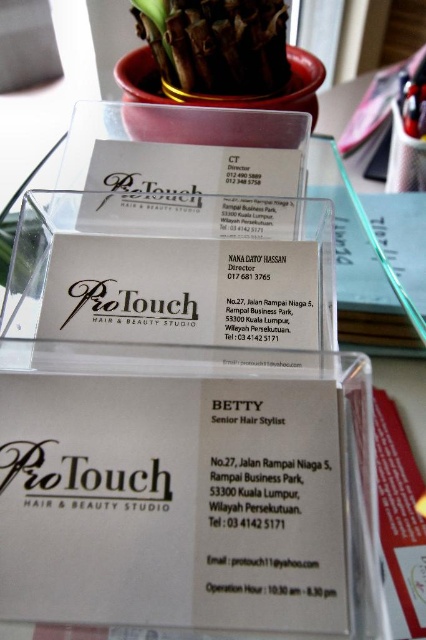
You are holding a camera and want to take a closeup photo of the white paper business card at center. The camera requires the subject to be within 20 inches to focus properly. Can you take the photo without moving the card?

The white paper business card at center is 23.71 inches from the camera, which is beyond the 20 inches required for proper focus. Therefore, you cannot take the photo without moving the card closer.

You are designing a layout for a business card holder and need to place a new card. The existing matte gold card at center is at point 0.456, 0.427. If you want to place a new card to the right of it, where should you place it?

To place the new card to the right of the matte gold card at center, you should position it at a coordinate with an x value greater than 0.456, such as 0.5 or higher, while keeping the y value around 0.427 to maintain alignment.